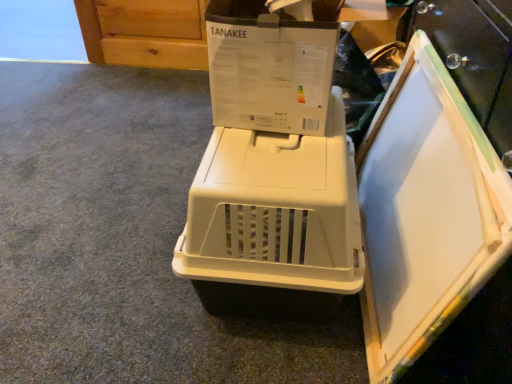
Question: Looking at their shapes, would you say white plastic board at right is wider or thinner than beige plastic pet carrier at center?

Choices:
 (A) thin
 (B) wide

Answer: (A)

Question: Is point (436, 218) closer or farther from the camera than point (351, 274)?

Choices:
 (A) closer
 (B) farther

Answer: (A)

Question: In terms of height, does white plastic board at right look taller or shorter compared to beige plastic pet carrier at center?

Choices:
 (A) short
 (B) tall

Answer: (B)

Question: Considering the relative positions of beige plastic pet carrier at center and white plastic board at right in the image provided, is beige plastic pet carrier at center to the left or to the right of white plastic board at right?

Choices:
 (A) right
 (B) left

Answer: (B)

Question: Considering the positions of beige plastic pet carrier at center and white plastic board at right in the image, is beige plastic pet carrier at center wider or thinner than white plastic board at right?

Choices:
 (A) thin
 (B) wide

Answer: (B)

Question: From the image's perspective, is beige plastic pet carrier at center located above or below white plastic board at right?

Choices:
 (A) below
 (B) above

Answer: (A)

Question: In terms of size, does beige plastic pet carrier at center appear bigger or smaller than white plastic board at right?

Choices:
 (A) big
 (B) small

Answer: (A)